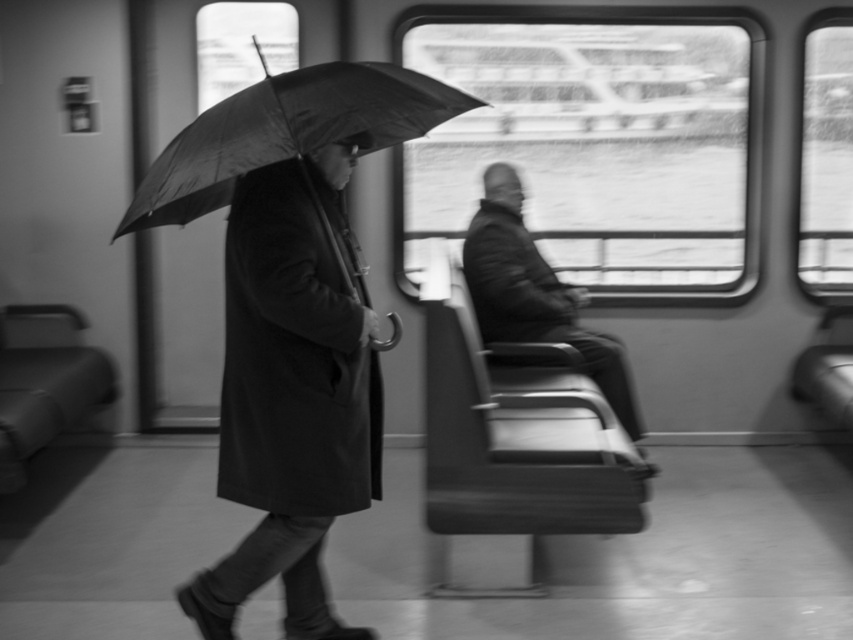
Can you confirm if black matte umbrella at left is positioned below coated black jacket at center?

Answer: Incorrect, black matte umbrella at left is not positioned below coated black jacket at center.

Measure the distance from black matte umbrella at left to coated black jacket at center.

black matte umbrella at left and coated black jacket at center are 5.77 feet apart from each other.

Is point (263, 124) positioned before point (508, 337)?

Yes, point (263, 124) is in front of point (508, 337).

Where is `black matte umbrella at left`? This screenshot has height=640, width=853. black matte umbrella at left is located at coordinates (285, 131).

Who is higher up, matte black umbrella at left or coated black jacket at center?

Positioned higher is coated black jacket at center.

From the picture: Who is more forward, (317, 596) or (508, 225)?

Positioned in front is point (317, 596).

You are a GUI agent. You are given a task and a screenshot of the screen. Output one action in this format:
    pyautogui.click(x=<x>, y=<y>)
    Task: Click on the matte black umbrella at left
    
    Given the screenshot: What is the action you would take?
    pyautogui.click(x=292, y=392)

The image size is (853, 640). Describe the element at coordinates (292, 392) in the screenshot. I see `matte black umbrella at left` at that location.

Looking at this image, does matte black umbrella at left have a greater width compared to black matte umbrella at left?

Incorrect, matte black umbrella at left's width does not surpass black matte umbrella at left's.

At what (x,y) coordinates should I click in order to perform the action: click on matte black umbrella at left. Please return your answer as a coordinate pair (x, y). The height and width of the screenshot is (640, 853). Looking at the image, I should click on (292, 392).